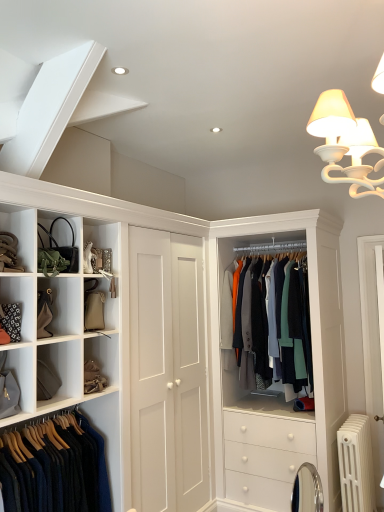
The image size is (384, 512). In order to click on dark blue wool sweater at lower left, the first clothing from the left in this screenshot , I will do `click(54, 467)`.

Find the location of a particular element. The height and width of the screenshot is (512, 384). dark blue wool sweater at lower left, the first clothing from the left is located at coordinates tap(54, 467).

Between textured wool coat at center, which ranks as the first clothing in right-to-left order, and white metallic radiator at lower right, which one is positioned behind?

textured wool coat at center, which ranks as the first clothing in right-to-left order, is further away from the camera.

At what (x,y) coordinates should I click in order to perform the action: click on the 1st clothing counting from the left of the white metallic radiator at lower right. Please return your answer as a coordinate pair (x, y). Looking at the image, I should click on (275, 324).

Can you see textured wool coat at center, the 2th clothing positioned from the front, touching white metallic radiator at lower right?

No, textured wool coat at center, the 2th clothing positioned from the front, is not making contact with white metallic radiator at lower right.

Considering the sizes of objects textured wool coat at center, which ranks as the first clothing in right-to-left order, and white metallic radiator at lower right in the image provided, who is thinner, textured wool coat at center, which ranks as the first clothing in right-to-left order, or white metallic radiator at lower right?

textured wool coat at center, which ranks as the first clothing in right-to-left order.

From the image's perspective, which is below, matte gray bag at lower left or tan leather belt at upper left?

matte gray bag at lower left appears lower in the image.

Who is bigger, matte gray bag at lower left or tan leather belt at upper left?

With larger size is tan leather belt at upper left.

Consider the image. From a real-world perspective, is matte gray bag at lower left positioned above or below tan leather belt at upper left?

matte gray bag at lower left is situated lower than tan leather belt at upper left in the real world.

In the image, is matte gray bag at lower left on the left side or the right side of tan leather belt at upper left?

From the image, it's evident that matte gray bag at lower left is to the right of tan leather belt at upper left.

From the image's perspective, is matte gray bag at lower left located beneath matte black handbag at upper left?

Correct, matte gray bag at lower left appears lower than matte black handbag at upper left in the image.

From a real-world perspective, is matte gray bag at lower left positioned under matte black handbag at upper left based on gravity?

Correct, in the physical world, matte gray bag at lower left is lower than matte black handbag at upper left.

From the image's perspective, which is below, textured wool coat at center, which ranks as the first clothing in right-to-left order, or matte gray bag at lower left?

matte gray bag at lower left is shown below in the image.

Which of these two, textured wool coat at center, which is counted as the 2th clothing, starting from the left, or matte gray bag at lower left, is bigger?

textured wool coat at center, which is counted as the 2th clothing, starting from the left, is bigger.

Locate an element on the screen. The width and height of the screenshot is (384, 512). shelf below the textured wool coat at center, which is counted as the 2th clothing, starting from the left (from the image's perspective) is located at coordinates (23, 375).

Is matte gray bag at lower left a part of textured wool coat at center, which ranks as the first clothing in back-to-front order?

No, textured wool coat at center, which ranks as the first clothing in back-to-front order, does not contain matte gray bag at lower left.

Looking at this image, who is shorter, white metallic radiator at lower right or textured wool coat at center, which ranks as the first clothing in back-to-front order?

With less height is white metallic radiator at lower right.

What's the angular difference between white metallic radiator at lower right and textured wool coat at center, which ranks as the first clothing in right-to-left order,'s facing directions?

The angular difference between white metallic radiator at lower right and textured wool coat at center, which ranks as the first clothing in right-to-left order, is 1.62 degrees.

Is white metallic radiator at lower right thinner than textured wool coat at center, which is counted as the 2th clothing, starting from the left?

Incorrect, the width of white metallic radiator at lower right is not less than that of textured wool coat at center, which is counted as the 2th clothing, starting from the left.

Is the position of white metallic radiator at lower right more distant than that of textured wool coat at center, which ranks as the first clothing in back-to-front order?

No, it is in front of textured wool coat at center, which ranks as the first clothing in back-to-front order.

Does tan leather belt at upper left turn towards white metallic radiator at lower right?

No, tan leather belt at upper left is not turned towards white metallic radiator at lower right.

Could white metallic radiator at lower right be considered to be inside tan leather belt at upper left?

No, white metallic radiator at lower right is not a part of tan leather belt at upper left.

Which is in front, point (36, 239) or point (372, 480)?

The point (36, 239) is in front.

Is dark blue wool sweater at lower left, which ranks as the first clothing in front-to-back order, positioned with its back to white metallic radiator at lower right?

dark blue wool sweater at lower left, which ranks as the first clothing in front-to-back order, is not turned away from white metallic radiator at lower right.

Which object is wider, dark blue wool sweater at lower left, which ranks as the 2th clothing in back-to-front order, or white metallic radiator at lower right?

With larger width is white metallic radiator at lower right.

Which is farther, (34, 447) or (359, 416)?

Positioned behind is point (359, 416).

From a real-world perspective, which object stands above the other?

dark blue wool sweater at lower left, the first clothing from the left, is physically above.

This screenshot has width=384, height=512. What are the coordinates of `the 2nd clothing located above the white metallic radiator at lower right (from a real-world perspective)` in the screenshot? It's located at (275, 324).

I want to click on cabinet on the left of matte gray bag at lower left, so click(x=23, y=234).

Which object lies nearer to the anchor point tan leather belt at upper left, textured wool coat at center, which is counted as the 2th clothing, starting from the left, or matte gray bag at lower left?

matte gray bag at lower left lies closer to tan leather belt at upper left than the other object.

Considering their positions, is dark blue wool sweater at lower left, which ranks as the first clothing in front-to-back order, positioned further to matte gray bag at lower left than textured wool coat at center, which ranks as the first clothing in back-to-front order?

textured wool coat at center, which ranks as the first clothing in back-to-front order, is further to matte gray bag at lower left.

When comparing their distances from matte gray bag at lower left, does textured wool coat at center, which ranks as the first clothing in back-to-front order, or tan leather belt at upper left seem further?

textured wool coat at center, which ranks as the first clothing in back-to-front order, is further to matte gray bag at lower left.

From the image, which object appears to be nearer to dark blue wool sweater at lower left, the second clothing positioned from the right, matte black handbag at upper left or textured wool coat at center, which ranks as the first clothing in back-to-front order?

Among the two, matte black handbag at upper left is located nearer to dark blue wool sweater at lower left, the second clothing positioned from the right.

Considering their positions, is matte gray bag at lower left positioned closer to tan leather belt at upper left than white metallic radiator at lower right?

Among the two, matte gray bag at lower left is located nearer to tan leather belt at upper left.

Estimate the real-world distances between objects in this image. Which object is further from dark blue wool sweater at lower left, the second clothing positioned from the right, matte gray bag at lower left or tan leather belt at upper left?

tan leather belt at upper left.

When comparing their distances from textured wool coat at center, which is counted as the 2th clothing, starting from the left, does dark blue wool sweater at lower left, which ranks as the 2th clothing in back-to-front order, or tan leather belt at upper left seem closer?

dark blue wool sweater at lower left, which ranks as the 2th clothing in back-to-front order.

Looking at the image, which one is located further to dark blue wool sweater at lower left, the second clothing positioned from the right, textured wool coat at center, the 2th clothing positioned from the front, or tan leather belt at upper left?

textured wool coat at center, the 2th clothing positioned from the front, lies further to dark blue wool sweater at lower left, the second clothing positioned from the right, than the other object.

This screenshot has height=512, width=384. Find the location of `clothing between dark blue wool sweater at lower left, which ranks as the 2th clothing in back-to-front order, and white metallic radiator at lower right`. clothing between dark blue wool sweater at lower left, which ranks as the 2th clothing in back-to-front order, and white metallic radiator at lower right is located at coordinates (275, 324).

In order to click on clothing situated between matte black handbag at upper left and white metallic radiator at lower right from left to right in this screenshot , I will do `click(275, 324)`.

The image size is (384, 512). I want to click on shelf between tan leather belt at upper left and white metallic radiator at lower right, so click(x=23, y=375).

Locate an element on the screen. accessory between dark blue wool sweater at lower left, which ranks as the 2th clothing in back-to-front order, and textured wool coat at center, which ranks as the first clothing in back-to-front order is located at coordinates (64, 246).